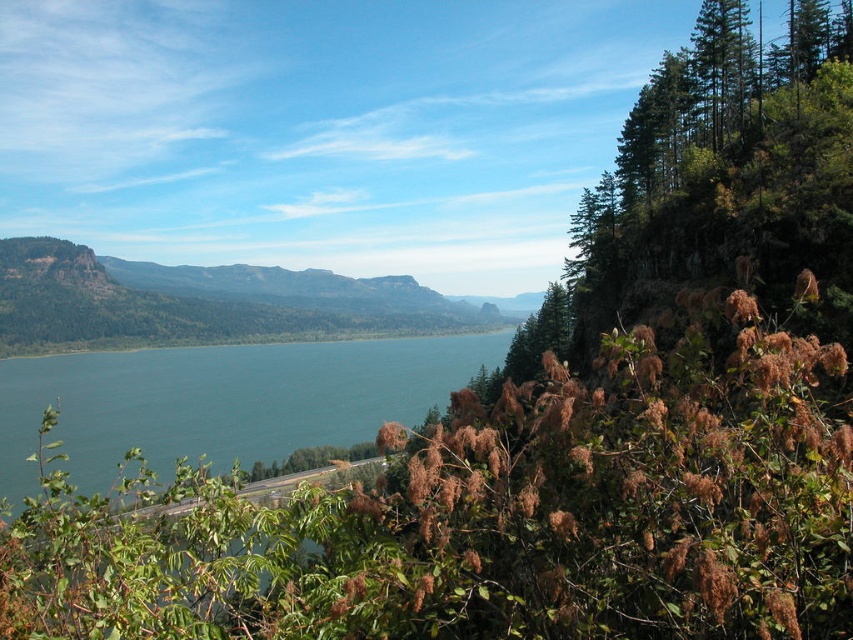
Can you confirm if blue water at center is taller than green forested mountain at center?

Incorrect, blue water at center's height is not larger of green forested mountain at center's.

Does blue water at center lie behind green forested mountain at center?

That is False.

Which is behind, point (373, 429) or point (196, 340)?

The point (196, 340) is behind.

This screenshot has width=853, height=640. Identify the location of blue water at center. (x=222, y=401).